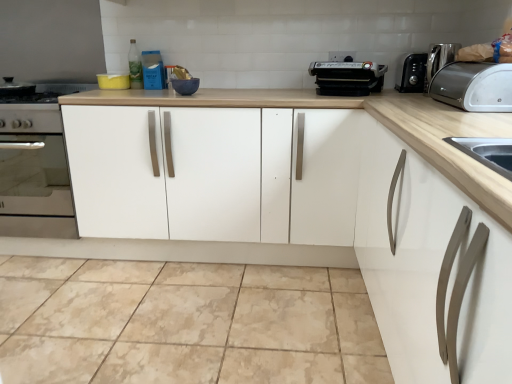
What do you see at coordinates (474, 86) in the screenshot? The image size is (512, 384). I see `satin silver toaster at upper right` at bounding box center [474, 86].

Locate an element on the screen. The height and width of the screenshot is (384, 512). satin silver coffee machine at upper right is located at coordinates (439, 59).

What do you see at coordinates (347, 78) in the screenshot? I see `black plastic grill at upper center` at bounding box center [347, 78].

This screenshot has height=384, width=512. Describe the element at coordinates (213, 174) in the screenshot. I see `white matte cabinet at center` at that location.

The image size is (512, 384). What are the coordinates of `satin silver toaster at upper right` in the screenshot? It's located at (474, 86).

Looking at their sizes, would you say black plastic grill at upper center is wider or thinner than beige marble tile at center?

Considering their sizes, black plastic grill at upper center looks slimmer than beige marble tile at center.

Is black plastic grill at upper center behind beige marble tile at center?

Yes, the depth of black plastic grill at upper center is greater than that of beige marble tile at center.

I want to click on appliance above the beige marble tile at center (from the image's perspective), so click(x=347, y=78).

Would you say black plastic grill at upper center is to the left or to the right of beige marble tile at center in the picture?

Clearly, black plastic grill at upper center is on the right of beige marble tile at center in the image.

Is satin silver toaster at upper right not close to beige marble tile at center?

satin silver toaster at upper right is far away from beige marble tile at center.

Considering the sizes of satin silver toaster at upper right and beige marble tile at center in the image, is satin silver toaster at upper right wider or thinner than beige marble tile at center?

In the image, satin silver toaster at upper right appears to be more narrow than beige marble tile at center.

Considering the positions of points (478, 89) and (250, 372), is point (478, 89) farther from camera compared to point (250, 372)?

No, it is in front of (250, 372).

From the picture: Is satin silver toaster at upper right closer to the viewer compared to beige marble tile at center?

No, satin silver toaster at upper right is further to the viewer.

Is white matte cabinet at center beside green glass bottle at upper center?

No, white matte cabinet at center is not making contact with green glass bottle at upper center.

Considering the sizes of objects white matte cabinet at center and green glass bottle at upper center in the image provided, who is taller, white matte cabinet at center or green glass bottle at upper center?

white matte cabinet at center is taller.

From a real-world perspective, which is physically below, white matte cabinet at center or green glass bottle at upper center?

white matte cabinet at center, from a real-world perspective.

Is the position of satin silver toaster at upper right more distant than that of green glass bottle at upper center?

That is False.

Between satin silver toaster at upper right and green glass bottle at upper center, which one appears on the right side from the viewer's perspective?

Positioned to the right is satin silver toaster at upper right.

Locate an element on the screen. bottle behind the satin silver toaster at upper right is located at coordinates (135, 67).

Is satin silver toaster at upper right facing away from green glass bottle at upper center?

That's not correct — satin silver toaster at upper right is not looking away from green glass bottle at upper center.

Is satin silver toaster at upper right to the left or to the right of satin silver coffee machine at upper right in the image?

In the image, satin silver toaster at upper right appears on the right side of satin silver coffee machine at upper right.

Considering the sizes of objects satin silver toaster at upper right and satin silver coffee machine at upper right in the image provided, who is taller, satin silver toaster at upper right or satin silver coffee machine at upper right?

satin silver coffee machine at upper right is taller.

Is satin silver toaster at upper right next to satin silver coffee machine at upper right and touching it?

No, satin silver toaster at upper right is not next to satin silver coffee machine at upper right.

From the image's perspective, is satin silver toaster at upper right above satin silver coffee machine at upper right?

Actually, satin silver toaster at upper right appears below satin silver coffee machine at upper right in the image.

Based on the photo, from the image's perspective, between satin silver coffee machine at upper right and green glass bottle at upper center, which one is located above?

green glass bottle at upper center is shown above in the image.

From the picture: Could you measure the distance between satin silver coffee machine at upper right and green glass bottle at upper center?

1.63 meters.

Is satin silver coffee machine at upper right to the right of green glass bottle at upper center from the viewer's perspective?

Indeed, satin silver coffee machine at upper right is positioned on the right side of green glass bottle at upper center.

Is satin silver coffee machine at upper right positioned in front of green glass bottle at upper center?

Yes, the depth of satin silver coffee machine at upper right is less than that of green glass bottle at upper center.

Consider the image. Is green glass bottle at upper center facing away from white matte cabinet at center?

green glass bottle at upper center does not have its back to white matte cabinet at center.

Does green glass bottle at upper center have a lesser width compared to white matte cabinet at center?

Yes, green glass bottle at upper center is thinner than white matte cabinet at center.

Based on the photo, is green glass bottle at upper center spatially inside white matte cabinet at center, or outside of it?

green glass bottle at upper center is not enclosed by white matte cabinet at center.

Is green glass bottle at upper center positioned in front of white matte cabinet at center?

No, green glass bottle at upper center is behind white matte cabinet at center.

This screenshot has width=512, height=384. Identify the location of ceramic tile that appears below the black plastic grill at upper center (from a real-world perspective). (185, 323).

Find the location of a particular element. Image resolution: width=512 pixels, height=384 pixels. ceramic tile below the satin silver toaster at upper right (from the image's perspective) is located at coordinates (185, 323).

Based on their spatial positions, is black plastic grill at upper center or white matte cabinet at center closer to beige marble tile at center?

white matte cabinet at center is positioned closer to the anchor beige marble tile at center.

Estimate the real-world distances between objects in this image. Which object is further from beige marble tile at center, white matte cabinet at center or black plastic grill at upper center?

The object further to beige marble tile at center is black plastic grill at upper center.

Looking at the image, which one is located closer to beige marble tile at center, satin silver toaster at upper right or black plastic grill at upper center?

Based on the image, black plastic grill at upper center appears to be nearer to beige marble tile at center.

From the image, which object appears to be farther from satin silver coffee machine at upper right, beige marble tile at center or satin silver toaster at upper right?

beige marble tile at center.

When comparing their distances from beige marble tile at center, does black plastic grill at upper center or satin silver coffee machine at upper right seem closer?

Based on the image, black plastic grill at upper center appears to be nearer to beige marble tile at center.

Which object lies nearer to the anchor point green glass bottle at upper center, satin silver coffee machine at upper right or beige marble tile at center?

beige marble tile at center is closer to green glass bottle at upper center.

From the image, which object appears to be nearer to satin silver coffee machine at upper right, satin silver toaster at upper right or beige marble tile at center?

Among the two, satin silver toaster at upper right is located nearer to satin silver coffee machine at upper right.

Estimate the real-world distances between objects in this image. Which object is closer to green glass bottle at upper center, satin silver toaster at upper right or white matte cabinet at center?

white matte cabinet at center.

This screenshot has width=512, height=384. What are the coordinates of `ceramic tile between green glass bottle at upper center and satin silver toaster at upper right` in the screenshot? It's located at (185, 323).

Identify the location of coffee machine located between satin silver toaster at upper right and black plastic grill at upper center in the depth direction. (439, 59).

Identify the location of appliance located between white matte cabinet at center and satin silver toaster at upper right in the left-right direction. The image size is (512, 384). (347, 78).

Where is `ceramic tile between green glass bottle at upper center and satin silver coffee machine at upper right in the horizontal direction`? ceramic tile between green glass bottle at upper center and satin silver coffee machine at upper right in the horizontal direction is located at coordinates point(185,323).